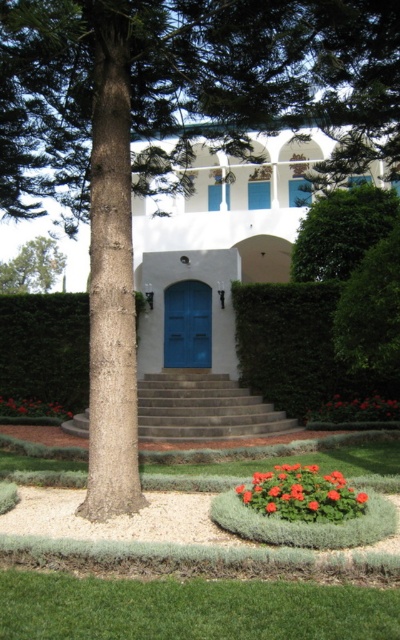
Question: Which of the following is the closest to the observer?

Choices:
 (A) (2, 316)
 (B) (326, 410)

Answer: (B)

Question: Can you confirm if green leafy bush at upper right is wider than vibrant red petals at center?

Choices:
 (A) no
 (B) yes

Answer: (B)

Question: Is green leafy hedge at center positioned in front of green textured bush at center?

Choices:
 (A) yes
 (B) no

Answer: (A)

Question: Estimate the real-world distances between objects in this image. Which object is closer to the smooth concrete stairs at center?

Choices:
 (A) bright red petals at lower center
 (B) bright orange flowers at lower center
 (C) green leafy tree at upper left
 (D) orange matte flower at center

Answer: (A)

Question: Is green textured bush at center in front of bright orange flowers at lower center?

Choices:
 (A) yes
 (B) no

Answer: (B)

Question: Among these objects, which one is farthest from the camera?

Choices:
 (A) green leafy tree at upper left
 (B) orange matte flower at center

Answer: (A)